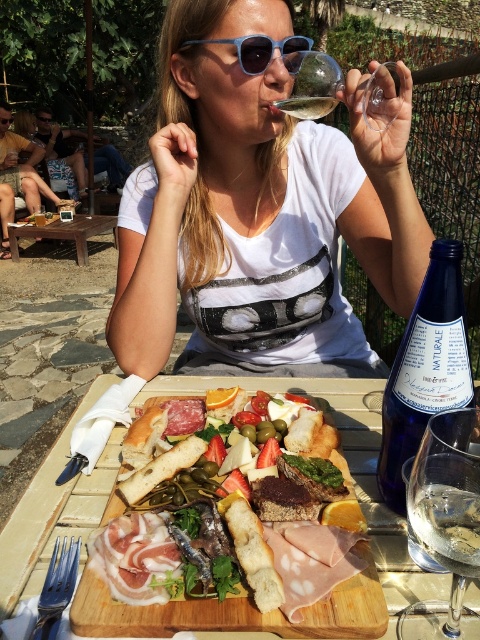
How much distance is there between clear glass wine at lower right and clear glass wine at upper center?

clear glass wine at lower right and clear glass wine at upper center are 59.17 centimeters apart.

Between clear glass wine at lower right and clear glass wine at upper center, which one has less height?

Standing shorter between the two is clear glass wine at upper center.

This screenshot has height=640, width=480. Describe the element at coordinates (446, 525) in the screenshot. I see `clear glass wine at lower right` at that location.

I want to click on clear glass wine at lower right, so click(x=446, y=525).

Which is more to the right, wooden cutting board with assorted charcuterie at center or clear glass wine at upper center?

Positioned to the right is clear glass wine at upper center.

Is point (291, 632) behind point (312, 118)?

No.

Find the location of a particular element. This screenshot has height=640, width=480. wooden cutting board with assorted charcuterie at center is located at coordinates (230, 618).

Is blue glass bottle at center-right above wooden table at lower left?

Incorrect, blue glass bottle at center-right is not positioned above wooden table at lower left.

Is point (437, 241) farther from camera compared to point (72, 228)?

No, (437, 241) is in front of (72, 228).

The width and height of the screenshot is (480, 640). Find the location of `blue glass bottle at center-right`. blue glass bottle at center-right is located at coordinates (424, 369).